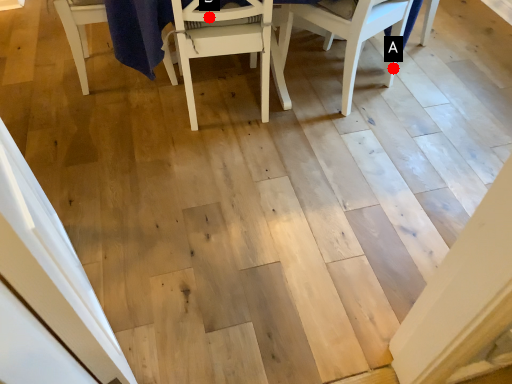
Question: Two points are circled on the image, labeled by A and B beside each circle. Which point appears closest to the camera in this image?

Choices:
 (A) A is closer
 (B) B is closer

Answer: (B)